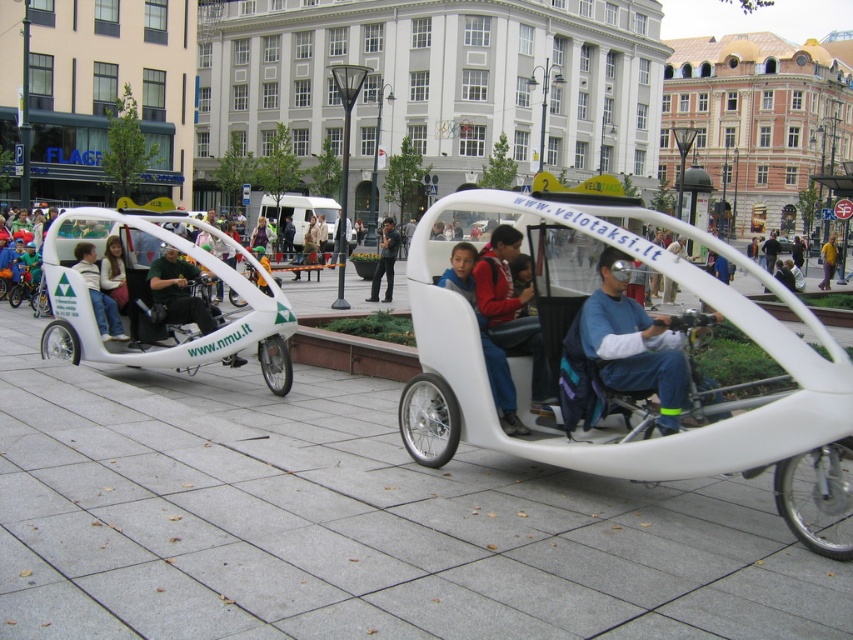
Consider the image. Is blue denim jeans at center shorter than matte white jacket at center?

In fact, blue denim jeans at center may be taller than matte white jacket at center.

Between point (608, 342) and point (84, 252), which one is positioned behind?

Positioned behind is point (84, 252).

Is point (619, 376) closer to viewer compared to point (90, 252)?

Yes, point (619, 376) is in front of point (90, 252).

Locate an element on the screen. blue denim jeans at center is located at coordinates (633, 342).

Which is behind, point (223, 328) or point (381, 225)?

Positioned behind is point (381, 225).

Who is more distant from viewer, (137, 310) or (374, 284)?

Positioned behind is point (374, 284).

Where is `white matte pedicab at left`? This screenshot has height=640, width=853. white matte pedicab at left is located at coordinates (161, 298).

Between point (798, 376) and point (473, 269), which one is positioned in front?

Point (798, 376) is in front.

Can you confirm if white matte pedicab at center is taller than red sweater at center?

Indeed, white matte pedicab at center has a greater height compared to red sweater at center.

What do you see at coordinates (635, 358) in the screenshot?
I see `white matte pedicab at center` at bounding box center [635, 358].

This screenshot has height=640, width=853. In order to click on white matte pedicab at center in this screenshot , I will do `click(635, 358)`.